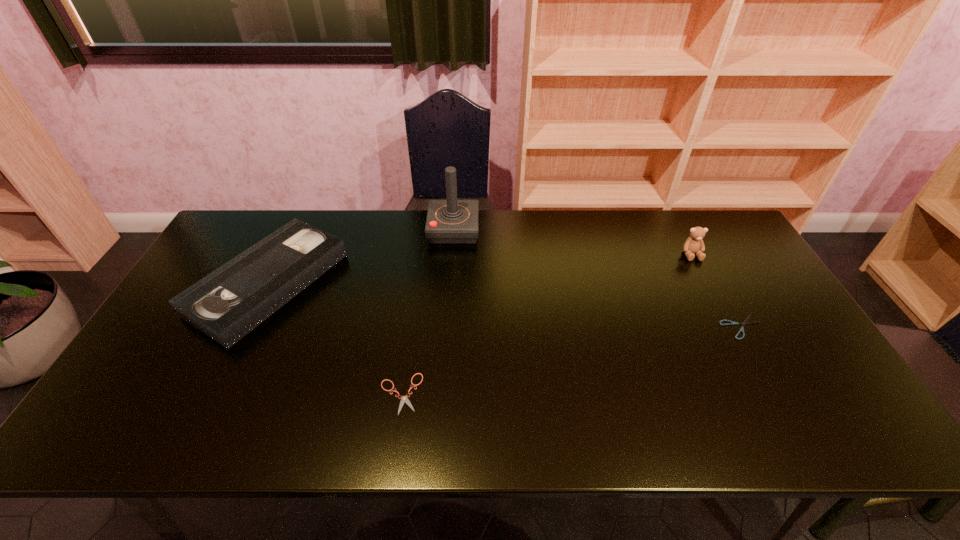
Locate an element on the screen. blank region between the joystick and the videotape is located at coordinates (361, 256).

The width and height of the screenshot is (960, 540). I want to click on vacant area that lies between the videotape and the right shears, so click(x=505, y=305).

This screenshot has height=540, width=960. In order to click on free space that is in between the fourth shortest object and the farther shears in this screenshot , I will do `click(717, 291)`.

Locate an element on the screen. This screenshot has height=540, width=960. vacant space that's between the videotape and the joystick is located at coordinates (361, 256).

The width and height of the screenshot is (960, 540). Identify the location of unoccupied position between the joystick and the nearest object. (427, 312).

You are a GUI agent. You are given a task and a screenshot of the screen. Output one action in this format:
    pyautogui.click(x=<x>, y=<y>)
    Task: Click on the vacant area between the farther shears and the second tallest object
    
    Given the screenshot: What is the action you would take?
    pyautogui.click(x=717, y=291)

Locate an element on the screen. the fourth closest object to the teddy bear is located at coordinates (227, 304).

Identify which object is the fourth closest to the right shears. Please provide its 2D coordinates. Your answer should be formatted as a tuple, i.e. [(x, y)], where the tuple contains the x and y coordinates of a point satisfying the conditions above.

[(227, 304)]

At what (x,y) coordinates should I click in order to perform the action: click on blank area in the image that satisfies the following two spatial constraints: 1. on the face of the right shears; 2. on the left side of the second tallest object. Please return your answer as a coordinate pair (x, y). Looking at the image, I should click on coord(730,327).

Identify the location of vacant position in the image that satisfies the following two spatial constraints: 1. on the face of the right shears; 2. on the left side of the fourth shortest object. (730, 327).